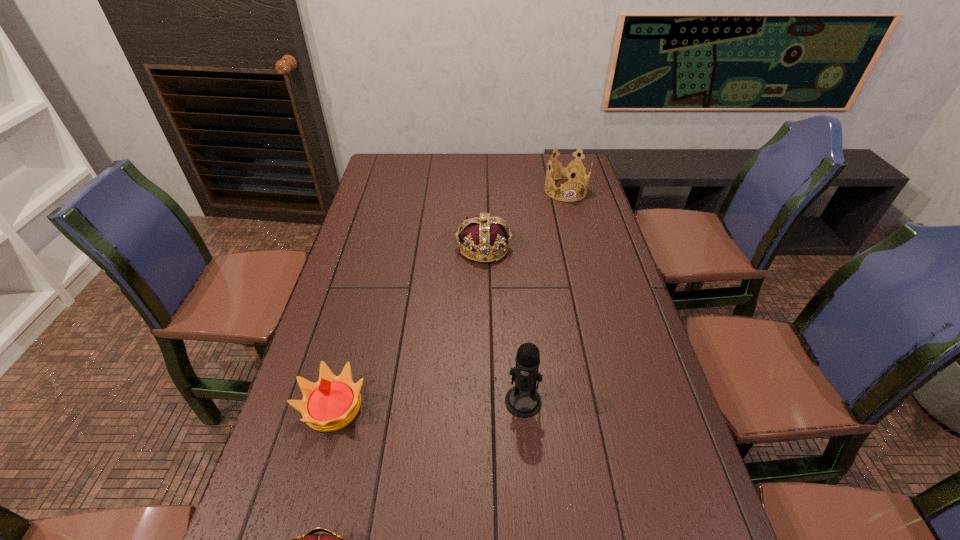
This screenshot has height=540, width=960. Find the location of `free space between the tallest object and the fourth tallest object`. free space between the tallest object and the fourth tallest object is located at coordinates (428, 404).

Where is `free area in between the second nearest crown and the rightmost crown`? The image size is (960, 540). free area in between the second nearest crown and the rightmost crown is located at coordinates (449, 299).

Image resolution: width=960 pixels, height=540 pixels. I want to click on object that stands as the second closest to the shortest object, so click(x=522, y=400).

Identify which object is the third closest to the microphone. Please provide its 2D coordinates. Your answer should be formatted as a tuple, i.e. [(x, y)], where the tuple contains the x and y coordinates of a point satisfying the conditions above.

[(486, 235)]

Find the location of `crown that can be found as the second closest to the shortest object`. crown that can be found as the second closest to the shortest object is located at coordinates pyautogui.click(x=486, y=235).

Locate an element on the screen. This screenshot has width=960, height=540. the closest crown to the third tallest crown is located at coordinates (309, 539).